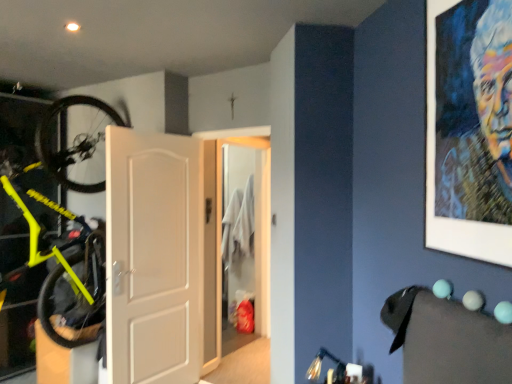
Locate an element on the screen. white glossy door at center, which is counted as the 2th door, starting from the front is located at coordinates (241, 240).

What do you see at coordinates (241, 240) in the screenshot? Image resolution: width=512 pixels, height=384 pixels. I see `white glossy door at center, positioned as the 1th door in back-to-front order` at bounding box center [241, 240].

At what (x,y) coordinates should I click in order to perform the action: click on oil painting portrait at upper right. Please return your answer as a coordinate pair (x, y). Looking at the image, I should click on (474, 112).

The height and width of the screenshot is (384, 512). Describe the element at coordinates (157, 258) in the screenshot. I see `white matte door at center, positioned as the 1th door in left-to-right order` at that location.

At what (x,y) coordinates should I click in order to perform the action: click on white glossy door at center, which is the 1th door in right-to-left order. Please return your answer as a coordinate pair (x, y). Looking at the image, I should click on (241, 240).

Is white glossy door at center, which is the 1th door in right-to-left order, outside of oil painting portrait at upper right?

white glossy door at center, which is the 1th door in right-to-left order, lies outside oil painting portrait at upper right's area.

Considering the sizes of white glossy door at center, positioned as the 1th door in back-to-front order, and oil painting portrait at upper right in the image, is white glossy door at center, positioned as the 1th door in back-to-front order, bigger or smaller than oil painting portrait at upper right?

In the image, white glossy door at center, positioned as the 1th door in back-to-front order, appears to be larger than oil painting portrait at upper right.

From the image's perspective, is white glossy door at center, positioned as the 2th door in left-to-right order, positioned above or below oil painting portrait at upper right?

white glossy door at center, positioned as the 2th door in left-to-right order, is below oil painting portrait at upper right.

From a real-world perspective, is white matte door at center, the second door positioned from the right, located beneath neon yellow matte bicycle at left?

Yes, from a real-world perspective, white matte door at center, the second door positioned from the right, is beneath neon yellow matte bicycle at left.

Which object is closer to the camera, white matte door at center, positioned as the second door in back-to-front order, or neon yellow matte bicycle at left?

neon yellow matte bicycle at left.

From the image's perspective, between white matte door at center, positioned as the 1th door in left-to-right order, and neon yellow matte bicycle at left, who is located below?

white matte door at center, positioned as the 1th door in left-to-right order, from the image's perspective.

Looking at this image, is neon yellow matte bicycle at left oriented away from white matte door at center, positioned as the second door in back-to-front order?

No, neon yellow matte bicycle at left's orientation is not away from white matte door at center, positioned as the second door in back-to-front order.

Which of these two, neon yellow matte bicycle at left or white matte door at center, which is the 1th door in front-to-back order, is thinner?

white matte door at center, which is the 1th door in front-to-back order, is thinner.

Does neon yellow matte bicycle at left lie in front of white matte door at center, positioned as the 1th door in left-to-right order?

Yes, neon yellow matte bicycle at left is closer to the viewer.

From a real-world perspective, is neon yellow matte bicycle at left physically located above or below white matte door at center, the second door positioned from the right?

Clearly, from a real-world perspective, neon yellow matte bicycle at left is above white matte door at center, the second door positioned from the right.

Can you tell me how much neon yellow matte bicycle at left and white glossy door at center, positioned as the 2th door in left-to-right order, differ in facing direction?

The facing directions of neon yellow matte bicycle at left and white glossy door at center, positioned as the 2th door in left-to-right order, are 92.3 degrees apart.

From a real-world perspective, who is located lower, neon yellow matte bicycle at left or white glossy door at center, which is the 1th door in right-to-left order?

white glossy door at center, which is the 1th door in right-to-left order, from a real-world perspective.

From the image's perspective, is neon yellow matte bicycle at left positioned above or below white glossy door at center, positioned as the 1th door in back-to-front order?

Based on their image positions, neon yellow matte bicycle at left is located above white glossy door at center, positioned as the 1th door in back-to-front order.

How distant is neon yellow matte bicycle at left from white glossy door at center, positioned as the 2th door in left-to-right order?

neon yellow matte bicycle at left is 5.96 feet away from white glossy door at center, positioned as the 2th door in left-to-right order.

Which object is further away from the camera taking this photo, white glossy door at center, which is the 1th door in right-to-left order, or white matte door at center, positioned as the 1th door in left-to-right order?

white glossy door at center, which is the 1th door in right-to-left order, is more distant.

Considering the relative sizes of white glossy door at center, which is the 1th door in right-to-left order, and white matte door at center, positioned as the second door in back-to-front order, in the image provided, is white glossy door at center, which is the 1th door in right-to-left order, bigger than white matte door at center, positioned as the second door in back-to-front order,?

Incorrect, white glossy door at center, which is the 1th door in right-to-left order, is not larger than white matte door at center, positioned as the second door in back-to-front order.

Is white glossy door at center, positioned as the 1th door in back-to-front order, facing towards white matte door at center, positioned as the 1th door in left-to-right order?

No, white glossy door at center, positioned as the 1th door in back-to-front order, is not facing towards white matte door at center, positioned as the 1th door in left-to-right order.

Does point (262, 209) come closer to viewer compared to point (131, 267)?

No, (262, 209) is behind (131, 267).

Based on the photo, from a real-world perspective, is white matte door at center, positioned as the 1th door in left-to-right order, located beneath oil painting portrait at upper right?

Yes.

Which is more to the left, white matte door at center, positioned as the second door in back-to-front order, or oil painting portrait at upper right?

Positioned to the left is white matte door at center, positioned as the second door in back-to-front order.

Which of these two, white matte door at center, the second door positioned from the right, or oil painting portrait at upper right, is thinner?

oil painting portrait at upper right is thinner.

Can you confirm if oil painting portrait at upper right is shorter than white matte door at center, positioned as the 1th door in left-to-right order?

Correct, oil painting portrait at upper right is not as tall as white matte door at center, positioned as the 1th door in left-to-right order.

Is point (466, 132) closer or farther from the camera than point (132, 233)?

Point (466, 132) is positioned closer to the camera compared to point (132, 233).

Would you say oil painting portrait at upper right is outside white matte door at center, positioned as the second door in back-to-front order?

Yes, oil painting portrait at upper right is outside of white matte door at center, positioned as the second door in back-to-front order.

Looking at this image, from a real-world perspective, between oil painting portrait at upper right and white matte door at center, positioned as the 1th door in left-to-right order, who is vertically higher?

oil painting portrait at upper right, from a real-world perspective.

Starting from the oil painting portrait at upper right, which door is the 1st one to the left? Please provide its 2D coordinates.

[(241, 240)]

You are a GUI agent. You are given a task and a screenshot of the screen. Output one action in this format:
    pyautogui.click(x=<x>, y=<y>)
    Task: Click on the bicycle above the white matte door at center, which is the 1th door in front-to-back order (from the image's perspective)
    The width and height of the screenshot is (512, 384).
    Given the screenshot: What is the action you would take?
    coord(66,209)

When comparing their distances from neon yellow matte bicycle at left, does white matte door at center, positioned as the second door in back-to-front order, or oil painting portrait at upper right seem closer?

Among the two, white matte door at center, positioned as the second door in back-to-front order, is located nearer to neon yellow matte bicycle at left.

Based on their spatial positions, is oil painting portrait at upper right or white matte door at center, positioned as the second door in back-to-front order, further from neon yellow matte bicycle at left?

Among the two, oil painting portrait at upper right is located further to neon yellow matte bicycle at left.

Which object lies further to the anchor point white glossy door at center, positioned as the 1th door in back-to-front order, neon yellow matte bicycle at left or white matte door at center, positioned as the 1th door in left-to-right order?

Based on the image, neon yellow matte bicycle at left appears to be further to white glossy door at center, positioned as the 1th door in back-to-front order.

Considering their positions, is neon yellow matte bicycle at left positioned further to white glossy door at center, which is the 1th door in right-to-left order, than oil painting portrait at upper right?

Based on the image, oil painting portrait at upper right appears to be further to white glossy door at center, which is the 1th door in right-to-left order.

Looking at this image, from the image, which object appears to be nearer to white glossy door at center, positioned as the 1th door in back-to-front order, oil painting portrait at upper right or white matte door at center, the second door positioned from the right?

white matte door at center, the second door positioned from the right, lies closer to white glossy door at center, positioned as the 1th door in back-to-front order, than the other object.

From the image, which object appears to be farther from oil painting portrait at upper right, white glossy door at center, which is counted as the 2th door, starting from the front, or white matte door at center, positioned as the 1th door in left-to-right order?

white glossy door at center, which is counted as the 2th door, starting from the front, is positioned further to the anchor oil painting portrait at upper right.

Based on their spatial positions, is white matte door at center, positioned as the second door in back-to-front order, or oil painting portrait at upper right closer to white glossy door at center, which is the 1th door in right-to-left order?

white matte door at center, positioned as the second door in back-to-front order, is positioned closer to the anchor white glossy door at center, which is the 1th door in right-to-left order.

From the image, which object appears to be nearer to white matte door at center, positioned as the 1th door in left-to-right order, oil painting portrait at upper right or white glossy door at center, positioned as the 2th door in left-to-right order?

Based on the image, white glossy door at center, positioned as the 2th door in left-to-right order, appears to be nearer to white matte door at center, positioned as the 1th door in left-to-right order.

In order to click on bicycle located between oil painting portrait at upper right and white glossy door at center, which is counted as the 2th door, starting from the front, in the depth direction in this screenshot , I will do `click(66, 209)`.

The width and height of the screenshot is (512, 384). In order to click on door between oil painting portrait at upper right and white glossy door at center, positioned as the 2th door in left-to-right order, from front to back in this screenshot , I will do `click(157, 258)`.

Locate an element on the screen. door between neon yellow matte bicycle at left and white glossy door at center, which is counted as the 2th door, starting from the front, in the front-back direction is located at coordinates tap(157, 258).